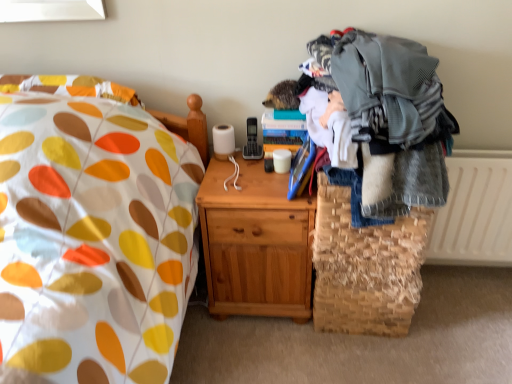
What do you see at coordinates (382, 115) in the screenshot? The width and height of the screenshot is (512, 384). I see `gray knitted sweater at right` at bounding box center [382, 115].

What is the approximate height of gray knitted sweater at right?

gray knitted sweater at right is 17.00 inches tall.

What is the approximate width of woven straw basket at lower right?

woven straw basket at lower right is 14.20 inches in width.

This screenshot has width=512, height=384. In order to click on gray knitted sweater at right in this screenshot , I will do `click(382, 115)`.

From a real-world perspective, is woven straw basket at lower right physically located above or below white textured radiator at right?

woven straw basket at lower right is situated lower than white textured radiator at right in the real world.

Can you confirm if woven straw basket at lower right is thinner than white textured radiator at right?

No, woven straw basket at lower right is not thinner than white textured radiator at right.

Does woven straw basket at lower right have a lesser height compared to white textured radiator at right?

Correct, woven straw basket at lower right is not as tall as white textured radiator at right.

Is woven straw basket at lower right inside or outside of white textured radiator at right?

woven straw basket at lower right is spatially situated outside white textured radiator at right.

From a real-world perspective, is light brown wood nightstand at center beneath white textured radiator at right?

Yes, from a real-world perspective, light brown wood nightstand at center is beneath white textured radiator at right.

In the image, is light brown wood nightstand at center on the left side or the right side of white textured radiator at right?

Based on their positions, light brown wood nightstand at center is located to the left of white textured radiator at right.

How different are the orientations of light brown wood nightstand at center and white textured radiator at right in degrees?

light brown wood nightstand at center and white textured radiator at right are facing 0.287 degrees away from each other.

Locate an element on the screen. Image resolution: width=512 pixels, height=384 pixels. nightstand located below the white textured radiator at right (from the image's perspective) is located at coordinates coord(256,243).

Which of these two, gray knitted sweater at right or woven straw basket at lower right, is wider?

gray knitted sweater at right is wider.

Considering the relative positions of gray knitted sweater at right and woven straw basket at lower right in the image provided, is gray knitted sweater at right to the left of woven straw basket at lower right from the viewer's perspective?

Correct, you'll find gray knitted sweater at right to the left of woven straw basket at lower right.

Considering the relative sizes of gray knitted sweater at right and woven straw basket at lower right in the image provided, is gray knitted sweater at right bigger than woven straw basket at lower right?

Yes.

Is gray knitted sweater at right aimed at woven straw basket at lower right?

No, gray knitted sweater at right is not facing towards woven straw basket at lower right.

Is woven straw basket at lower right smaller than gray knitted sweater at right?

Indeed, woven straw basket at lower right has a smaller size compared to gray knitted sweater at right.

Who is taller, woven straw basket at lower right or gray knitted sweater at right?

Standing taller between the two is gray knitted sweater at right.

Find the location of `basket that is on the right side of gray knitted sweater at right`. basket that is on the right side of gray knitted sweater at right is located at coordinates coord(365,267).

Based on the photo, from the image's perspective, is woven straw basket at lower right on gray knitted sweater at right?

Actually, woven straw basket at lower right appears below gray knitted sweater at right in the image.

Is light brown wood nightstand at center completely or partially outside of woven straw basket at lower right?

Yes, light brown wood nightstand at center is outside of woven straw basket at lower right.

Where is `nightstand above the woven straw basket at lower right (from a real-world perspective)`? nightstand above the woven straw basket at lower right (from a real-world perspective) is located at coordinates (256, 243).

Which is more to the right, light brown wood nightstand at center or woven straw basket at lower right?

woven straw basket at lower right.

Considering the sizes of objects light brown wood nightstand at center and woven straw basket at lower right in the image provided, who is bigger, light brown wood nightstand at center or woven straw basket at lower right?

Bigger between the two is light brown wood nightstand at center.

In the scene shown: Can you confirm if light brown wood nightstand at center is taller than gray knitted sweater at right?

Yes, light brown wood nightstand at center is taller than gray knitted sweater at right.

Does light brown wood nightstand at center turn towards gray knitted sweater at right?

No, light brown wood nightstand at center is not facing towards gray knitted sweater at right.

How far apart are light brown wood nightstand at center and gray knitted sweater at right?

They are 16.78 inches apart.

You are a GUI agent. You are given a task and a screenshot of the screen. Output one action in this format:
    pyautogui.click(x=<x>, y=<y>)
    Task: Click on the clothing that is above the light brown wood nightstand at center (from the image's perspective)
    
    Given the screenshot: What is the action you would take?
    pyautogui.click(x=382, y=115)

From a real-world perspective, which object stands above the other?

From a 3D spatial view, gray knitted sweater at right is above.

From the image's perspective, which is below, gray knitted sweater at right or light brown wood nightstand at center?

light brown wood nightstand at center, from the image's perspective.

Can you confirm if gray knitted sweater at right is shorter than light brown wood nightstand at center?

Yes, gray knitted sweater at right is shorter than light brown wood nightstand at center.

The width and height of the screenshot is (512, 384). In order to click on basket located below the white textured radiator at right (from the image's perspective) in this screenshot , I will do `click(365, 267)`.

This screenshot has height=384, width=512. In order to click on nightstand that appears below the white textured radiator at right (from a real-world perspective) in this screenshot , I will do `click(256, 243)`.

Consider the image. Estimate the real-world distances between objects in this image. Which object is further from gray knitted sweater at right, white textured radiator at right or woven straw basket at lower right?

Among the two, white textured radiator at right is located further to gray knitted sweater at right.

From the image, which object appears to be nearer to gray knitted sweater at right, woven straw basket at lower right or white textured radiator at right?

woven straw basket at lower right is closer to gray knitted sweater at right.

Which object lies nearer to the anchor point white textured radiator at right, light brown wood nightstand at center or gray knitted sweater at right?

gray knitted sweater at right lies closer to white textured radiator at right than the other object.

When comparing their distances from woven straw basket at lower right, does gray knitted sweater at right or light brown wood nightstand at center seem further?

gray knitted sweater at right is further to woven straw basket at lower right.

Considering their positions, is white textured radiator at right positioned further to woven straw basket at lower right than gray knitted sweater at right?

The object further to woven straw basket at lower right is white textured radiator at right.

Estimate the real-world distances between objects in this image. Which object is closer to gray knitted sweater at right, light brown wood nightstand at center or white textured radiator at right?

The object closer to gray knitted sweater at right is light brown wood nightstand at center.

Looking at the image, which one is located further to woven straw basket at lower right, light brown wood nightstand at center or white textured radiator at right?

white textured radiator at right lies further to woven straw basket at lower right than the other object.

From the image, which object appears to be farther from woven straw basket at lower right, white textured radiator at right or light brown wood nightstand at center?

white textured radiator at right.

I want to click on nightstand between gray knitted sweater at right and woven straw basket at lower right in the up-down direction, so click(256, 243).

You are a GUI agent. You are given a task and a screenshot of the screen. Output one action in this format:
    pyautogui.click(x=<x>, y=<y>)
    Task: Click on the clothing situated between light brown wood nightstand at center and white textured radiator at right from left to right
    This screenshot has width=512, height=384.
    Given the screenshot: What is the action you would take?
    pyautogui.click(x=382, y=115)

This screenshot has height=384, width=512. Identify the location of basket located between gray knitted sweater at right and white textured radiator at right in the depth direction. (365, 267).

Where is `basket between light brown wood nightstand at center and white textured radiator at right from left to right`? The width and height of the screenshot is (512, 384). basket between light brown wood nightstand at center and white textured radiator at right from left to right is located at coordinates (365, 267).